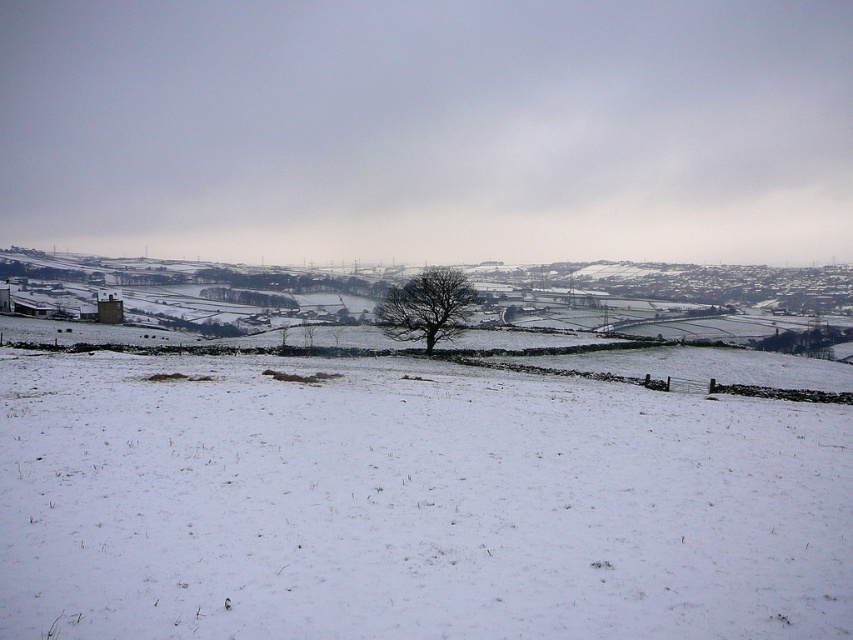
Question: Is white powdery snow at center below bare brown tree at center?

Choices:
 (A) yes
 (B) no

Answer: (A)

Question: Which point is farther to the camera?

Choices:
 (A) pyautogui.click(x=253, y=481)
 (B) pyautogui.click(x=445, y=276)

Answer: (B)

Question: Which of the following is the closest to the observer?

Choices:
 (A) (421, 305)
 (B) (88, 476)

Answer: (B)

Question: Which of the following is the closest to the observer?

Choices:
 (A) white powdery snow at center
 (B) bare brown tree at center

Answer: (A)

Question: Can you confirm if white powdery snow at center is positioned below bare brown tree at center?

Choices:
 (A) yes
 (B) no

Answer: (A)

Question: From the image, what is the correct spatial relationship of white powdery snow at center in relation to bare brown tree at center?

Choices:
 (A) above
 (B) below

Answer: (B)